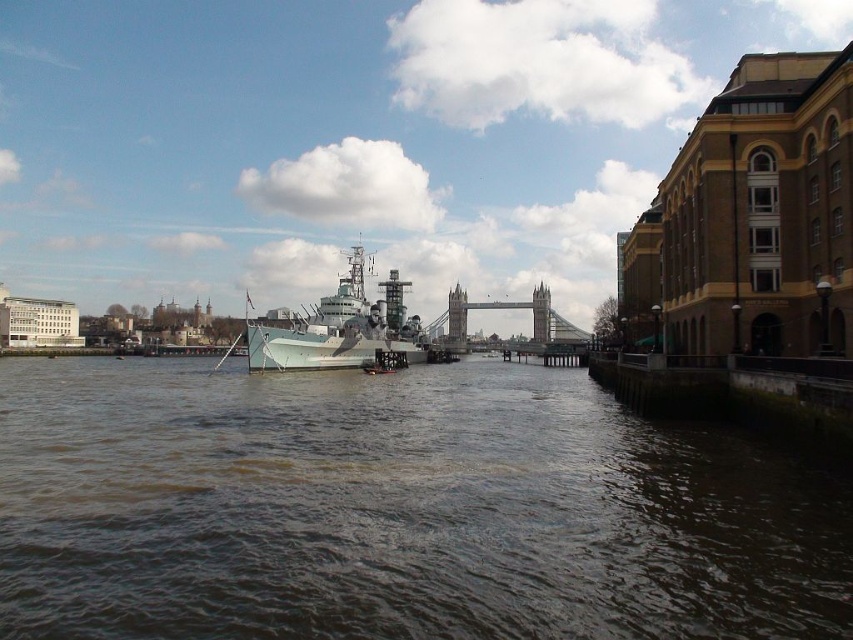
You are standing at the point with coordinates point (x=350, y=294) and want to walk towards the point with coordinates point (x=611, y=492). Will you be moving towards the foreground or the background of the image?

Since point (x=611, y=492) is in front of point (x=350, y=294), moving towards point (x=611, y=492) would mean moving towards the foreground of the image.

Based on the scene described, which object takes up more area in the image between the brown murky water at center and the stone gray bridge at center?

The stone gray bridge at center occupies more area in the image than the brown murky water at center.

You are standing on the observation deck of the Tower Bridge and looking down at the brown murky water at center. If you drop a small pebble into the water, how far will it travel before hitting the water surface?

The brown murky water at center is 154.02 feet away from the viewer, so the pebble will travel 154.02 feet before hitting the water surface.